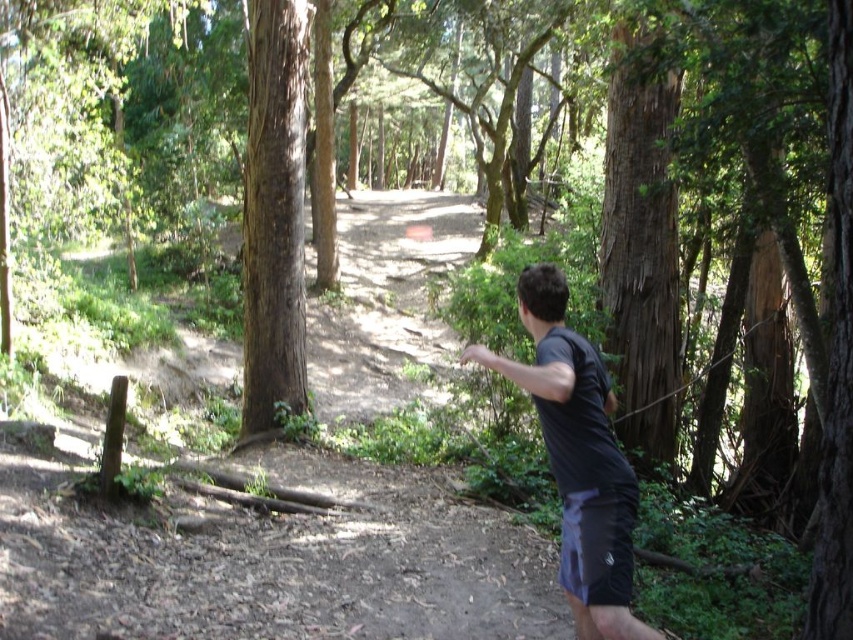
You are standing at the point labeled point (274, 32) and want to walk to the point labeled point (598, 445). Which direction should you move?

You should move forward because point (598, 445) is in front of point (274, 32) from your current position.